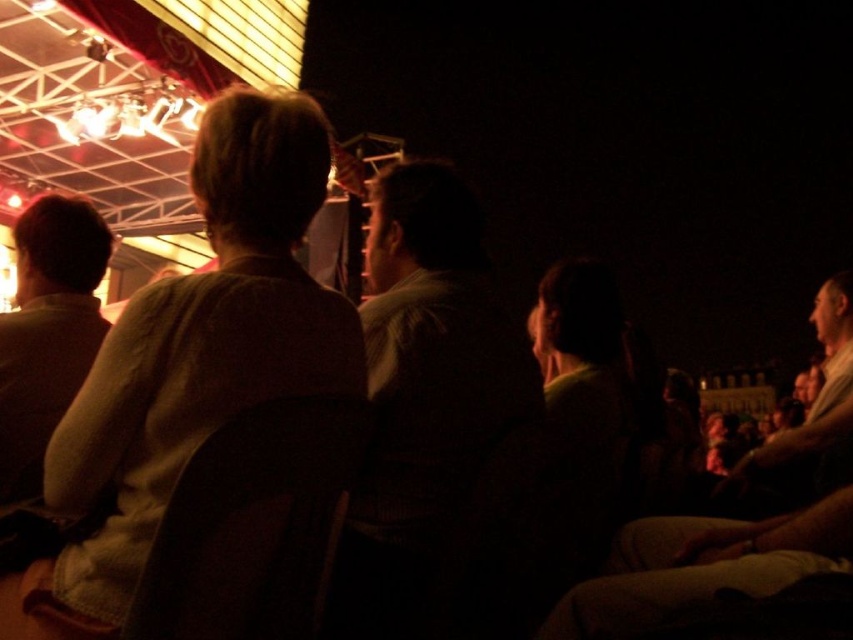
Between light brown fabric jacket at center and dark brown sweater at center, which one has less height?

Standing shorter between the two is light brown fabric jacket at center.

Which is more to the left, light brown fabric jacket at center or dark brown sweater at center?

light brown fabric jacket at center is more to the left.

Between point (103, 385) and point (416, 243), which one is positioned in front?

Point (103, 385) is more forward.

Locate an element on the screen. light brown fabric jacket at center is located at coordinates (190, 360).

Between light brown fabric jacket at center and light brown shirt at left, which one has more height?

With more height is light brown fabric jacket at center.

Is light brown fabric jacket at center thinner than light brown shirt at left?

No, light brown fabric jacket at center is not thinner than light brown shirt at left.

Which is in front, point (225, 364) or point (4, 456)?

Point (225, 364) is more forward.

At what (x,y) coordinates should I click in order to perform the action: click on light brown fabric jacket at center. Please return your answer as a coordinate pair (x, y). The width and height of the screenshot is (853, 640). Looking at the image, I should click on (190, 360).

Does dark brown sweater at center have a smaller size compared to light brown shirt at left?

Actually, dark brown sweater at center might be larger than light brown shirt at left.

Which of these two, dark brown sweater at center or light brown shirt at left, stands shorter?

With less height is light brown shirt at left.

Is point (486, 500) in front of point (57, 337)?

No, (486, 500) is further to viewer.

Locate an element on the screen. The image size is (853, 640). dark brown sweater at center is located at coordinates (428, 410).